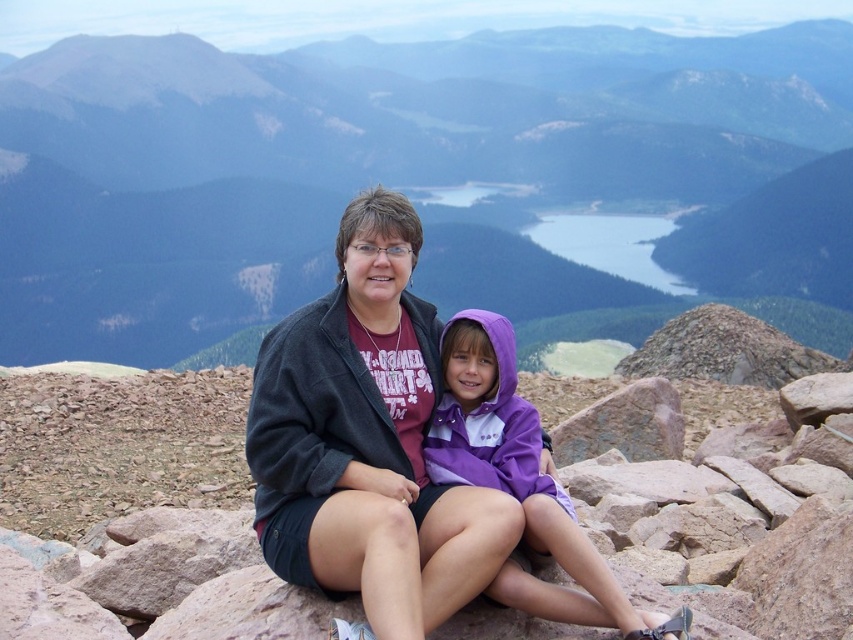
Question: Which is nearer to the purple fleece jacket at center?

Choices:
 (A) rugged stone mountain at center
 (B) dark gray jacket at center
 (C) dark gray fleece sweatshirt at center

Answer: (B)

Question: Can you confirm if rugged stone mountain at center is bigger than purple fleece jacket at center?

Choices:
 (A) no
 (B) yes

Answer: (B)

Question: Which object is closer to the camera taking this photo?

Choices:
 (A) purple fleece jacket at center
 (B) dark gray jacket at center

Answer: (A)

Question: Which object appears closest to the camera in this image?

Choices:
 (A) purple fleece jacket at center
 (B) dark gray jacket at center
 (C) dark gray fleece sweatshirt at center
 (D) rugged stone mountain at center

Answer: (A)

Question: Where is dark gray jacket at center located in relation to purple fleece jacket at center in the image?

Choices:
 (A) above
 (B) below

Answer: (A)

Question: Is dark gray jacket at center positioned at the back of dark gray fleece sweatshirt at center?

Choices:
 (A) no
 (B) yes

Answer: (A)